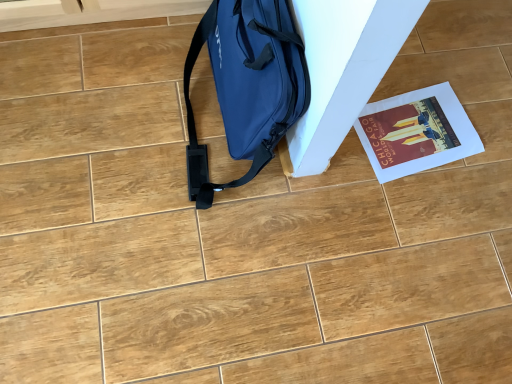
The height and width of the screenshot is (384, 512). I want to click on unoccupied space behind matte paper poster at lower right, so click(440, 71).